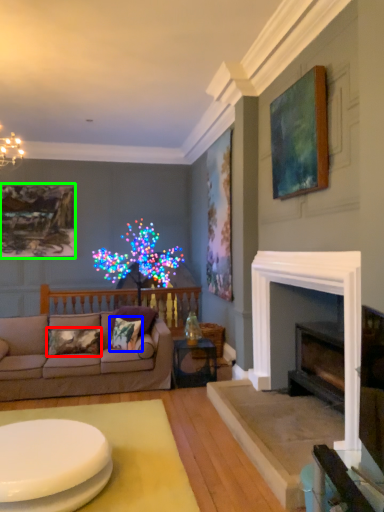
Question: Estimate the real-world distances between objects in this image. Which object is closer to pillow (highlighted by a red box), pillow (highlighted by a blue box) or picture frame (highlighted by a green box)?

Choices:
 (A) pillow
 (B) picture frame

Answer: (A)